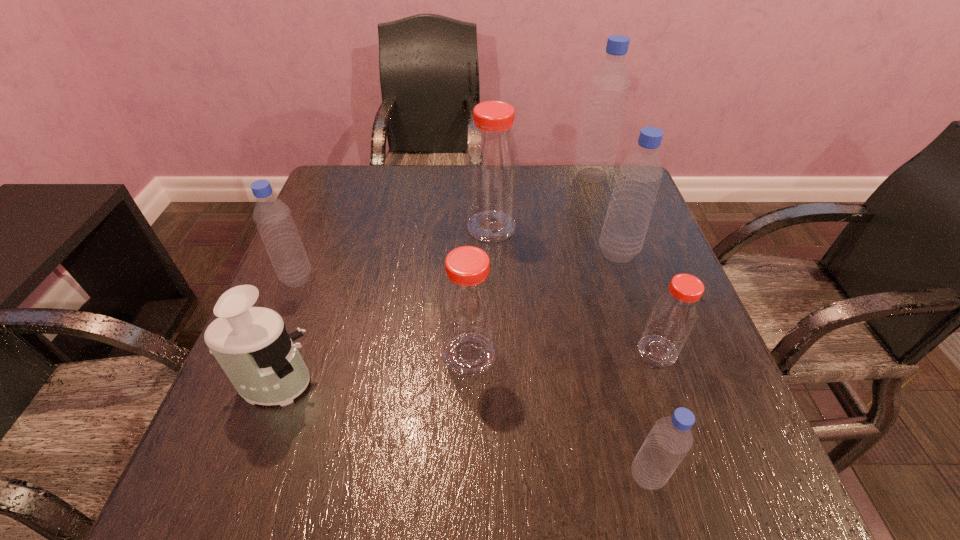
Locate an element on the screen. free spot between the leftmost blue bottle and the biggest red bottle is located at coordinates (395, 253).

Image resolution: width=960 pixels, height=540 pixels. In order to click on empty space that is in between the second farthest blue bottle and the smallest red bottle in this screenshot , I will do `click(637, 302)`.

Where is `free space between the farthest object and the juicer`? The image size is (960, 540). free space between the farthest object and the juicer is located at coordinates (433, 280).

Find the location of a particular element. The height and width of the screenshot is (540, 960). vacant area that lies between the nearest blue bottle and the third nearest blue bottle is located at coordinates (633, 364).

The width and height of the screenshot is (960, 540). I want to click on vacant space that is in between the tallest bottle and the leftmost blue bottle, so click(x=444, y=227).

At what (x,y) coordinates should I click in order to perform the action: click on vacant area that lies between the fourth nearest bottle and the second smallest red bottle. Please return your answer as a coordinate pair (x, y). This screenshot has width=960, height=540. Looking at the image, I should click on (384, 316).

Locate an element on the screen. unoccupied position between the farthest bottle and the second farthest blue bottle is located at coordinates (605, 214).

Locate an element on the screen. The image size is (960, 540). vacant space that is in between the second biggest red bottle and the nearest blue bottle is located at coordinates (559, 415).

I want to click on object that is the fourth closest one to the third smallest blue bottle, so click(x=468, y=303).

Image resolution: width=960 pixels, height=540 pixels. Find the location of `object that is the third nearest to the rightmost red bottle`. object that is the third nearest to the rightmost red bottle is located at coordinates (468, 303).